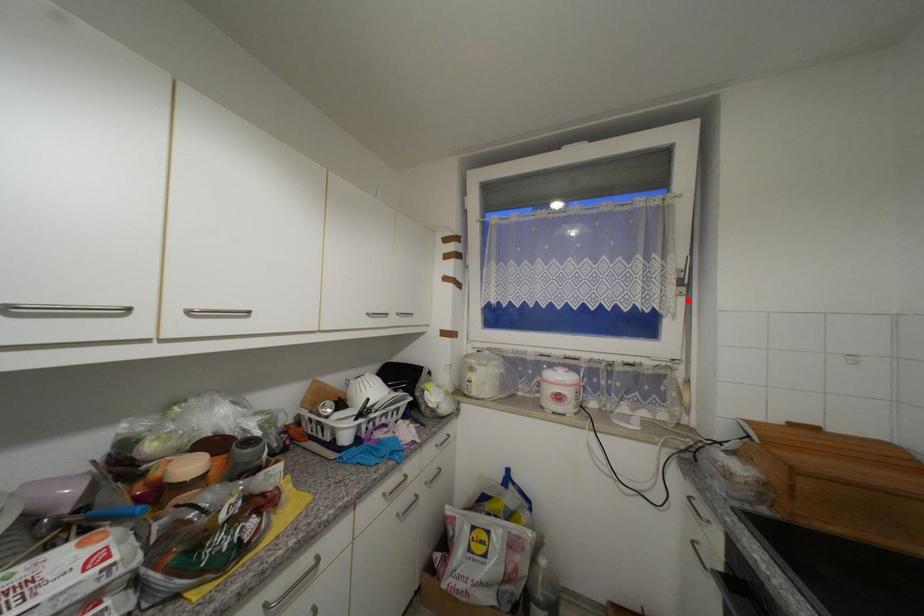
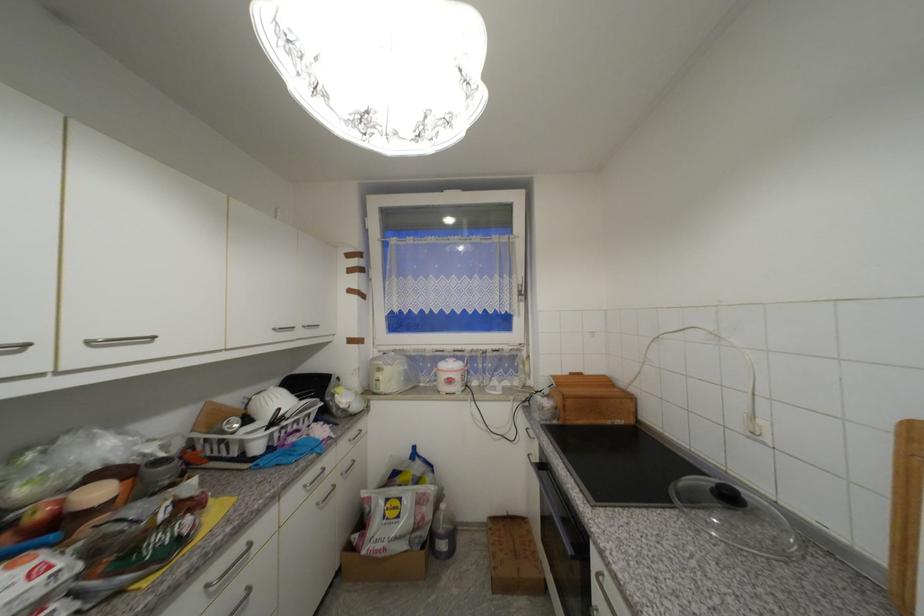
Where in the second image is the point corresponding to the highlighted location from the first image?

(528, 306)